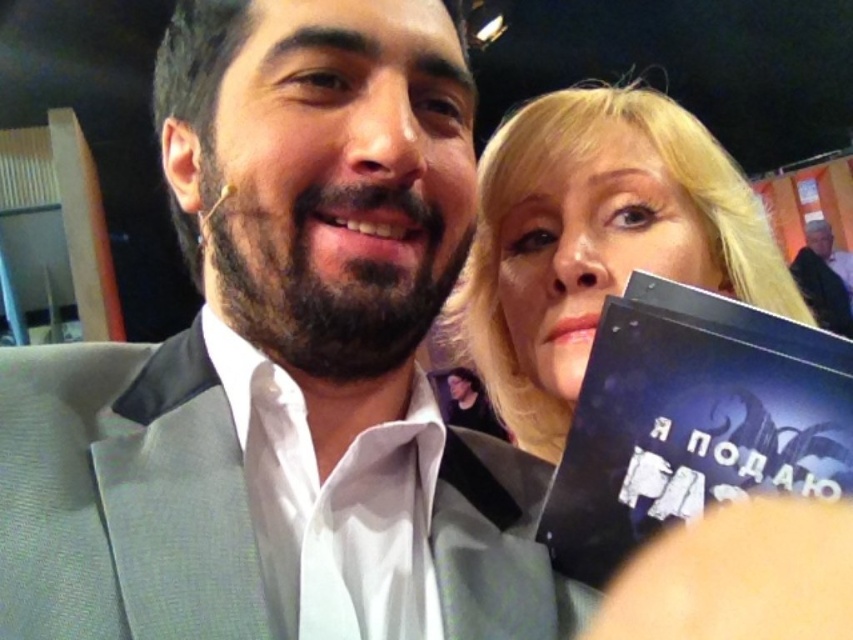
Who is positioned more to the right, blonde hair at upper right or light brown leather jacket at upper right?

From the viewer's perspective, light brown leather jacket at upper right appears more on the right side.

Identify the location of blonde hair at upper right. tap(596, 241).

Does gray suit at center have a lesser width compared to dark blue hardcover book at right?

No.

Where is `gray suit at center`? This screenshot has height=640, width=853. gray suit at center is located at coordinates (282, 365).

Can you confirm if gray suit at center is shorter than light brown leather jacket at upper right?

Yes.

Is gray suit at center wider than light brown leather jacket at upper right?

Incorrect, gray suit at center's width does not surpass light brown leather jacket at upper right's.

Does point (15, 352) come farther from viewer compared to point (815, 304)?

No.

Where is `gray suit at center`? The image size is (853, 640). gray suit at center is located at coordinates (282, 365).